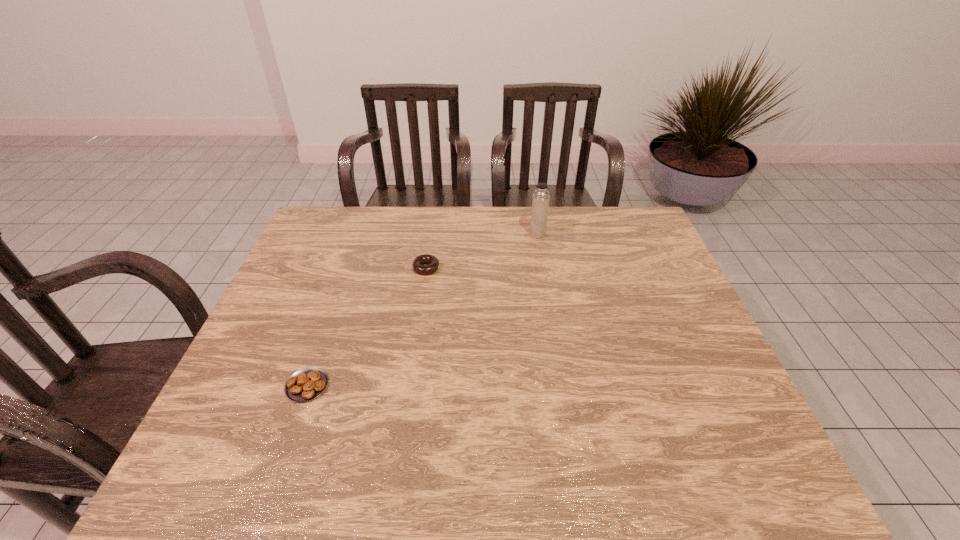
This screenshot has width=960, height=540. In order to click on the farthest object in this screenshot , I will do `click(540, 204)`.

Identify the location of the rightmost object. Image resolution: width=960 pixels, height=540 pixels. (540, 204).

The width and height of the screenshot is (960, 540). I want to click on doughnut, so click(x=433, y=262).

I want to click on the second nearest object, so click(433, 262).

Find the location of a particular element. Image resolution: width=960 pixels, height=540 pixels. pastry is located at coordinates (308, 383).

Where is `the leftmost object`? the leftmost object is located at coordinates (308, 383).

Locate an element on the screen. Image resolution: width=960 pixels, height=540 pixels. free space located on the right of the thermos bottle is located at coordinates (646, 234).

This screenshot has height=540, width=960. Identify the location of free space located on the back of the doughnut. (431, 237).

Image resolution: width=960 pixels, height=540 pixels. I want to click on blank space located 0.100m on the front of the leftmost object, so click(286, 446).

Identify the location of object that is positioned at the far edge. (540, 204).